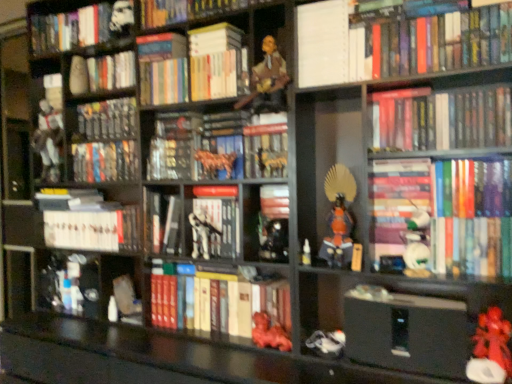
Question: Is metallic gold figurine at center, the 8th toy in the right-to-left sequence, facing towards shiny black figurine at center, which ranks as the sixth toy in left-to-right order?

Choices:
 (A) no
 (B) yes

Answer: (A)

Question: Is metallic gold figurine at center, the 8th toy in the right-to-left sequence, wider than shiny black figurine at center, marked as the sixth toy in a right-to-left arrangement?

Choices:
 (A) yes
 (B) no

Answer: (B)

Question: Is metallic gold figurine at center, the 4th toy in the left-to-right sequence, closer to the viewer compared to shiny black figurine at center, marked as the sixth toy in a right-to-left arrangement?

Choices:
 (A) yes
 (B) no

Answer: (B)

Question: Is metallic gold figurine at center, the 8th toy in the right-to-left sequence, looking in the opposite direction of shiny black figurine at center, which ranks as the sixth toy in left-to-right order?

Choices:
 (A) no
 (B) yes

Answer: (A)

Question: From a real-world perspective, is metallic gold figurine at center, the 4th toy in the left-to-right sequence, on top of shiny black figurine at center, which ranks as the sixth toy in left-to-right order?

Choices:
 (A) no
 (B) yes

Answer: (B)

Question: Does metallic gold figurine at center, the 4th toy in the left-to-right sequence, lie behind shiny black figurine at center, marked as the sixth toy in a right-to-left arrangement?

Choices:
 (A) no
 (B) yes

Answer: (B)

Question: Considering the relative sizes of white matte armor at left, marked as the 11th toy in a right-to-left arrangement, and rubberized red toy at lower right, which ranks as the eleventh toy in left-to-right order, in the image provided, is white matte armor at left, marked as the 11th toy in a right-to-left arrangement, wider than rubberized red toy at lower right, which ranks as the eleventh toy in left-to-right order,?

Choices:
 (A) yes
 (B) no

Answer: (A)

Question: Considering the relative sizes of white matte armor at left, marked as the first toy in a left-to-right arrangement, and rubberized red toy at lower right, the first toy in the right-to-left sequence, in the image provided, is white matte armor at left, marked as the first toy in a left-to-right arrangement, thinner than rubberized red toy at lower right, the first toy in the right-to-left sequence,?

Choices:
 (A) yes
 (B) no

Answer: (B)

Question: Is white matte armor at left, marked as the 11th toy in a right-to-left arrangement, surrounding rubberized red toy at lower right, the first toy in the right-to-left sequence?

Choices:
 (A) no
 (B) yes

Answer: (A)

Question: From a real-world perspective, is white matte armor at left, marked as the 11th toy in a right-to-left arrangement, positioned under rubberized red toy at lower right, the first toy in the right-to-left sequence, based on gravity?

Choices:
 (A) no
 (B) yes

Answer: (A)

Question: Is white matte armor at left, marked as the first toy in a left-to-right arrangement, bigger than rubberized red toy at lower right, the first toy in the right-to-left sequence?

Choices:
 (A) yes
 (B) no

Answer: (A)

Question: Is white matte armor at left, marked as the first toy in a left-to-right arrangement, oriented away from rubberized red toy at lower right, the first toy in the right-to-left sequence?

Choices:
 (A) no
 (B) yes

Answer: (A)

Question: Considering the relative sizes of hardcover books at upper right, positioned as the eighth book in bottom-to-top order, and white matte book at center, which appears as the thirteenth book when viewed from the top, in the image provided, is hardcover books at upper right, positioned as the eighth book in bottom-to-top order, wider than white matte book at center, which appears as the thirteenth book when viewed from the top,?

Choices:
 (A) yes
 (B) no

Answer: (B)